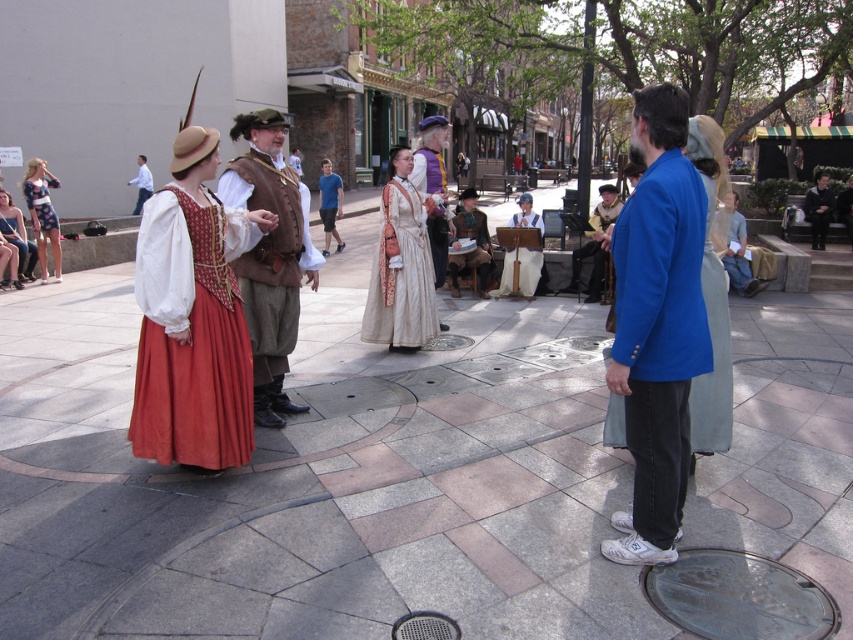
Question: Is matte white blouse at lower left above wooden lectern at center?

Choices:
 (A) no
 (B) yes

Answer: (B)

Question: Which object is farther from the camera taking this photo?

Choices:
 (A) light blue fabric dress at center
 (B) metallic gray manhole cover at center
 (C) matte white blouse at lower left
 (D) velvet black coat at center

Answer: (D)

Question: Does light gray fabric dress at center have a greater width compared to matte white blouse at lower left?

Choices:
 (A) no
 (B) yes

Answer: (B)

Question: Can you confirm if matte cream dress at center is positioned above wooden lectern at center?

Choices:
 (A) yes
 (B) no

Answer: (B)

Question: Which point is farther to the camera?

Choices:
 (A) (440, 337)
 (B) (32, 184)

Answer: (B)

Question: Estimate the real-world distances between objects in this image. Which object is farther from the white satin dress at center?

Choices:
 (A) printed cotton dress at left
 (B) white cotton dress at center
 (C) matte white blouse at lower left
 (D) white cotton shirt at upper left

Answer: (D)